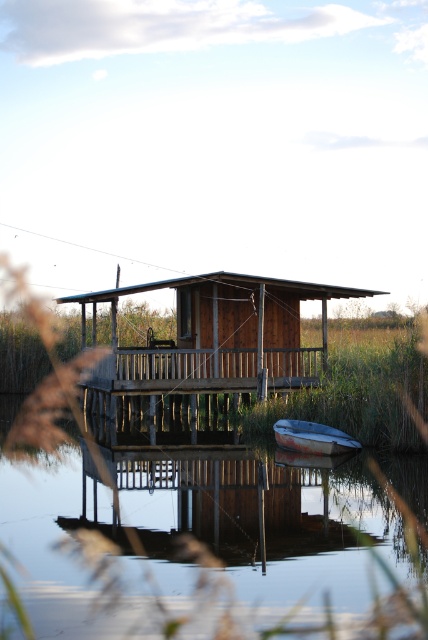
Can you confirm if transparent water at center is positioned to the left of rusty metal boat at lower center?

Correct, you'll find transparent water at center to the left of rusty metal boat at lower center.

Is point (45, 484) farther from viewer compared to point (302, 444)?

No, it is not.

Find the location of a particular element. The width and height of the screenshot is (428, 640). transparent water at center is located at coordinates (214, 540).